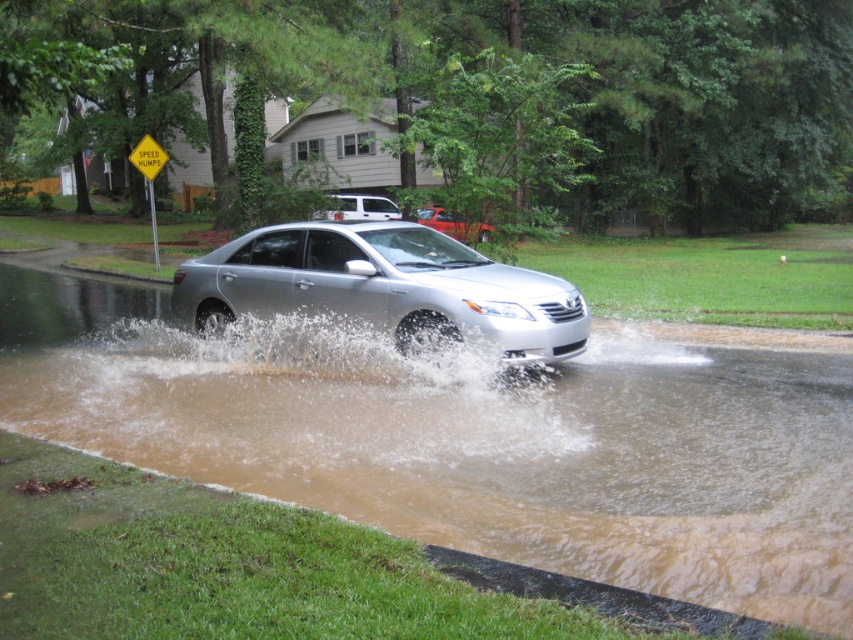
Does silver metallic sedan at center come behind matte silver sedan at center?

No, it is in front of matte silver sedan at center.

Measure the distance from silver metallic sedan at center to matte silver sedan at center.

The distance of silver metallic sedan at center from matte silver sedan at center is 9.47 meters.

Does point (497, 266) lie in front of point (451, 227)?

Yes, it is.

The height and width of the screenshot is (640, 853). Identify the location of silver metallic sedan at center. (383, 289).

Is brown muddy water at center shorter than brown frothy water at center?

In fact, brown muddy water at center may be taller than brown frothy water at center.

Can you confirm if brown muddy water at center is bigger than brown frothy water at center?

Yes.

Is point (9, 330) closer to viewer compared to point (341, 436)?

No, (9, 330) is further to viewer.

Locate an element on the screen. The width and height of the screenshot is (853, 640). brown muddy water at center is located at coordinates (473, 442).

Which of these two, brown muddy water at center or silver metallic sedan at center, stands shorter?

brown muddy water at center is shorter.

Is point (775, 412) farther from camera compared to point (303, 276)?

No.

Is point (364, 404) positioned behind point (254, 280)?

No, it is not.

The height and width of the screenshot is (640, 853). Find the location of `brown muddy water at center`. brown muddy water at center is located at coordinates (473, 442).